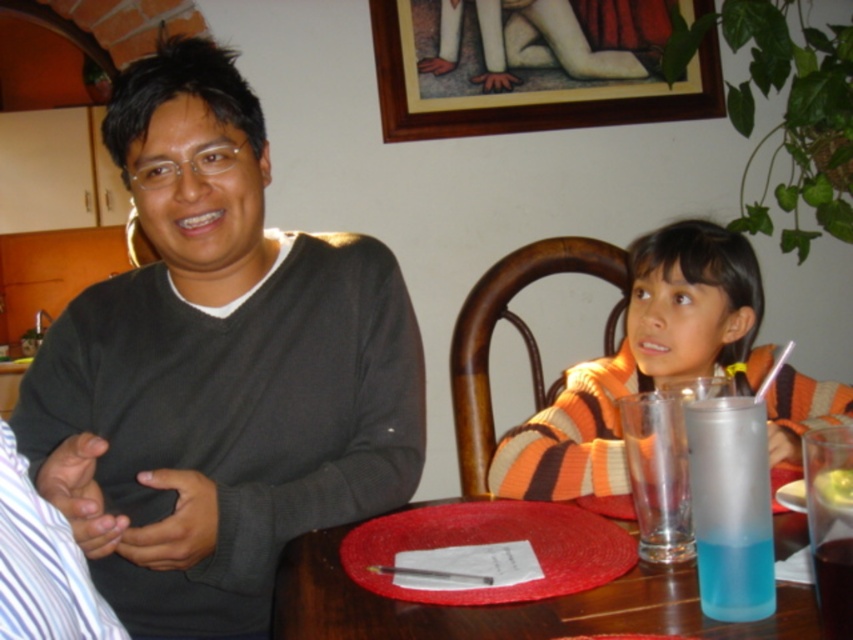
Question: Which object is closer to the camera taking this photo?

Choices:
 (A) striped sweater at center
 (B) blue translucent cup at table center
 (C) translucent plastic cup at table center
 (D) yellow creamy food at center

Answer: (B)

Question: Among these points, which one is nearest to the camera?

Choices:
 (A) (722, 403)
 (B) (685, 292)
 (C) (256, 444)

Answer: (A)

Question: In this image, where is smooth wooden table at center located relative to blue translucent cup at table center?

Choices:
 (A) right
 (B) left

Answer: (B)

Question: Does dark gray sweater at left have a smaller size compared to yellow creamy food at center?

Choices:
 (A) no
 (B) yes

Answer: (A)

Question: Is striped sweater at center positioned in front of yellow creamy food at center?

Choices:
 (A) no
 (B) yes

Answer: (A)

Question: Which of the following is the farthest from the observer?

Choices:
 (A) (828, 477)
 (B) (830, 621)

Answer: (B)